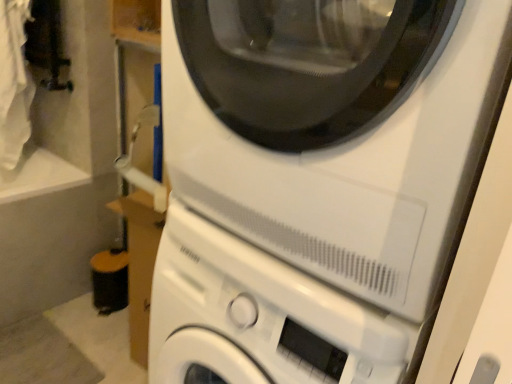
Question: Are white matte washing machine at center, the first washing machine viewed from the top, and white matte washing machine at center, placed as the first washing machine when sorted from bottom to top, located far from each other?

Choices:
 (A) no
 (B) yes

Answer: (A)

Question: Does white matte washing machine at center, the first washing machine viewed from the top, appear on the left side of white matte washing machine at center, placed as the first washing machine when sorted from bottom to top?

Choices:
 (A) yes
 (B) no

Answer: (B)

Question: Is white matte washing machine at center, the first washing machine viewed from the top, in front of white matte washing machine at center, which is counted as the second washing machine, starting from the top?

Choices:
 (A) no
 (B) yes

Answer: (B)

Question: Is white matte washing machine at center, the first washing machine viewed from the top, smaller than white matte washing machine at center, placed as the first washing machine when sorted from bottom to top?

Choices:
 (A) yes
 (B) no

Answer: (A)

Question: Does white matte washing machine at center, the first washing machine viewed from the top, have a greater height compared to white matte washing machine at center, which is counted as the second washing machine, starting from the top?

Choices:
 (A) yes
 (B) no

Answer: (B)

Question: Can you confirm if white matte washing machine at center, which is the 2th washing machine from bottom to top, is wider than white matte washing machine at center, which is counted as the second washing machine, starting from the top?

Choices:
 (A) no
 (B) yes

Answer: (A)

Question: Does white matte washing machine at center, which is counted as the second washing machine, starting from the top, have a greater width compared to white matte washing machine at center, the first washing machine viewed from the top?

Choices:
 (A) yes
 (B) no

Answer: (A)

Question: Can we say white matte washing machine at center, which is counted as the second washing machine, starting from the top, lies outside white matte washing machine at center, which is the 2th washing machine from bottom to top?

Choices:
 (A) yes
 (B) no

Answer: (A)

Question: Is white matte washing machine at center, placed as the first washing machine when sorted from bottom to top, looking in the opposite direction of white matte washing machine at center, which is the 2th washing machine from bottom to top?

Choices:
 (A) yes
 (B) no

Answer: (B)

Question: Is white matte washing machine at center, which is counted as the second washing machine, starting from the top, touching white matte washing machine at center, which is the 2th washing machine from bottom to top?

Choices:
 (A) yes
 (B) no

Answer: (A)

Question: From the image's perspective, is white matte washing machine at center, which is counted as the second washing machine, starting from the top, below white matte washing machine at center, the first washing machine viewed from the top?

Choices:
 (A) yes
 (B) no

Answer: (A)

Question: Does white matte washing machine at center, placed as the first washing machine when sorted from bottom to top, lie in front of white matte washing machine at center, the first washing machine viewed from the top?

Choices:
 (A) no
 (B) yes

Answer: (A)

Question: From their relative heights in the image, would you say white matte washing machine at center, which is counted as the second washing machine, starting from the top, is taller or shorter than white matte washing machine at center, the first washing machine viewed from the top?

Choices:
 (A) tall
 (B) short

Answer: (A)